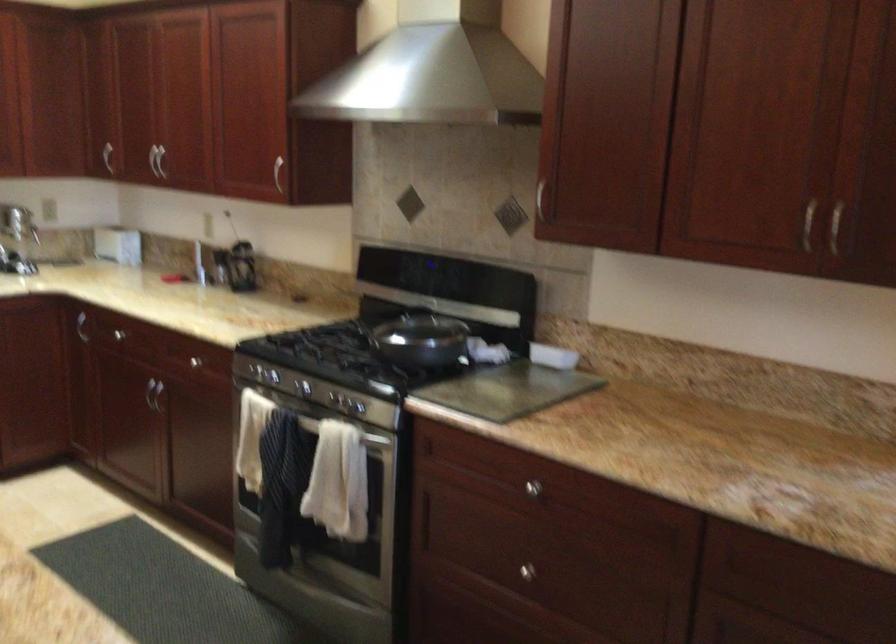
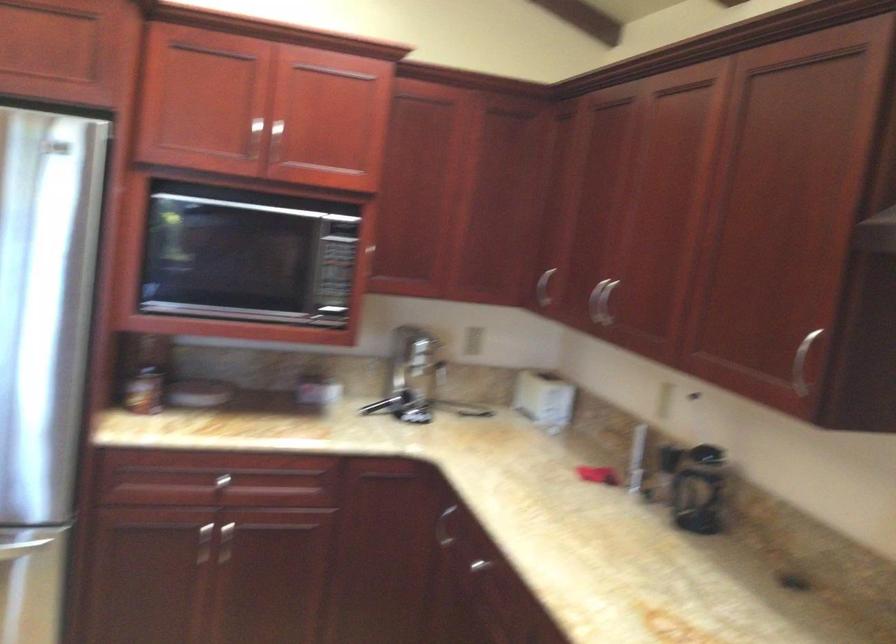
Where in the second image is the point corresponding to (131,323) from the first image?

(495, 567)